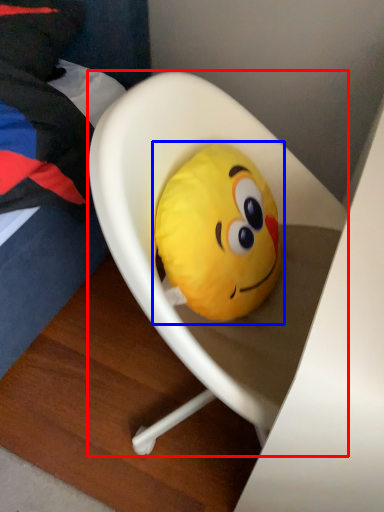
Question: Which object is further to the camera taking this photo, furniture (highlighted by a red box) or toy (highlighted by a blue box)?

Choices:
 (A) furniture
 (B) toy

Answer: (B)